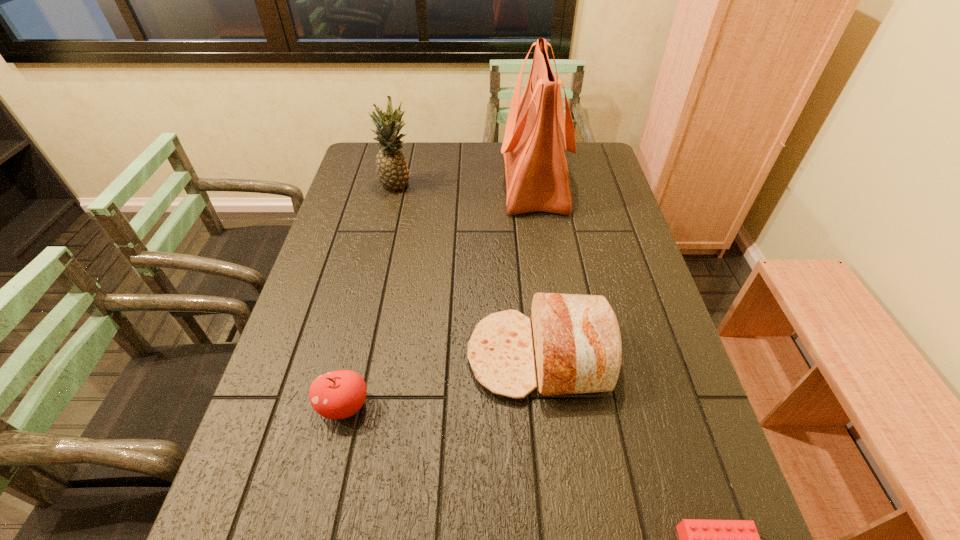
This screenshot has height=540, width=960. What are the coordinates of `vacant space at the left edge of the desktop` in the screenshot? It's located at (373, 196).

At what (x,y) coordinates should I click in order to perform the action: click on vacant space at the right edge. Please return your answer as a coordinate pair (x, y). This screenshot has width=960, height=540. Looking at the image, I should click on (666, 326).

Identify the location of vacant space at the far left corner of the desktop. (360, 144).

Where is `free region at the far right corner`? The height and width of the screenshot is (540, 960). free region at the far right corner is located at coordinates (601, 159).

Identify the location of vacant area between the tallest object and the apple. This screenshot has height=540, width=960. (439, 293).

I want to click on vacant space that is in between the third shortest object and the pineapple, so click(468, 271).

Identify the location of vacant area that lies between the second shortest object and the third tallest object. (442, 381).

Image resolution: width=960 pixels, height=540 pixels. Find the location of `vacant space in between the pineapple and the apple`. vacant space in between the pineapple and the apple is located at coordinates (371, 296).

The width and height of the screenshot is (960, 540). Identify the location of vacant space that is in between the apple and the tallest object. (439, 293).

Locate an element on the screen. free space between the bread and the tallest object is located at coordinates (537, 268).